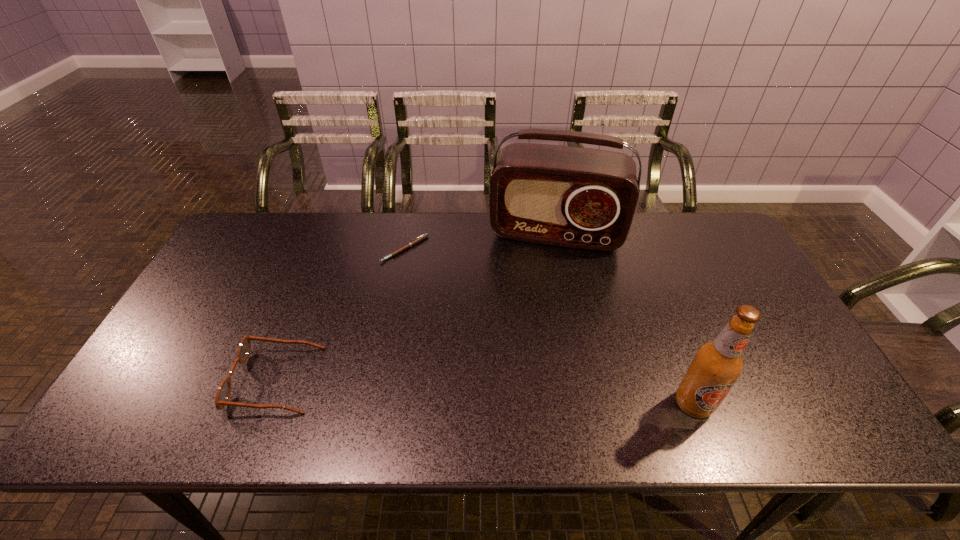
In the image, there is a desktop. Identify the location of free space at the near edge. The height and width of the screenshot is (540, 960). (x=429, y=388).

Identify the location of vacant space at the left edge of the desktop. (189, 315).

This screenshot has height=540, width=960. What are the coordinates of `vacant space at the right edge of the desktop` in the screenshot? It's located at (782, 320).

In the image, there is a desktop. Identify the location of vacant space at the far left corner. This screenshot has height=540, width=960. (231, 240).

In order to click on vacant region at the far right corner of the desktop in this screenshot , I will do `click(739, 256)`.

What are the coordinates of `free space between the second shortest object and the pen` in the screenshot? It's located at (340, 315).

Locate an element on the screen. free point between the radio receiver and the second object from left to right is located at coordinates (480, 241).

Locate an element on the screen. The height and width of the screenshot is (540, 960). empty space between the beer bottle and the second object from left to right is located at coordinates (549, 327).

This screenshot has width=960, height=540. What are the coordinates of `vacant space that's between the leftmost object and the radio receiver` in the screenshot? It's located at (416, 307).

Identify the location of free spot between the beer bottle and the shortest object. (549, 327).